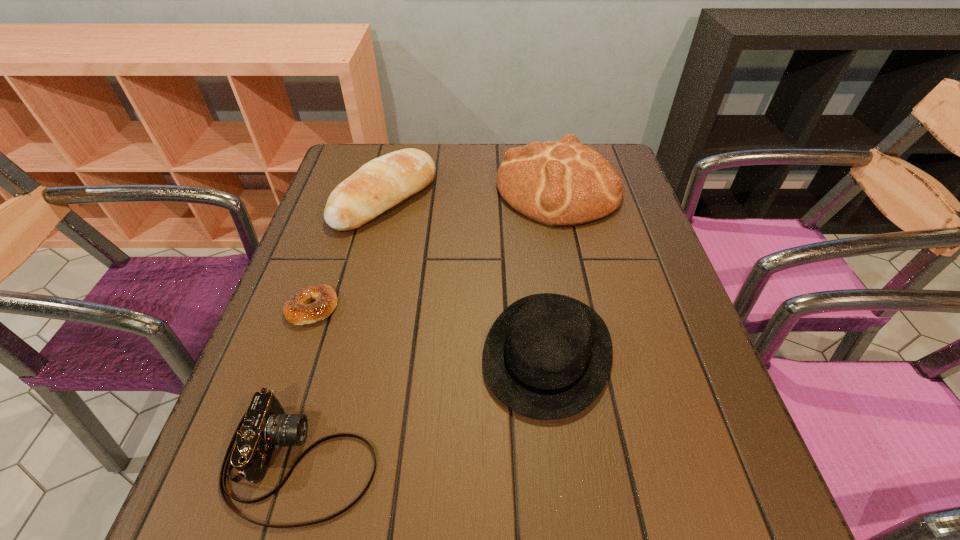
This screenshot has width=960, height=540. In order to click on free space at the far edge of the desktop in this screenshot , I will do `click(463, 163)`.

Find the location of a particular element. vacant area at the near edge is located at coordinates (408, 505).

Identify the location of vacant area at the right edge of the desktop. The image size is (960, 540). (678, 462).

Where is `vacant space at the far left corner`? This screenshot has width=960, height=540. vacant space at the far left corner is located at coordinates (351, 170).

Image resolution: width=960 pixels, height=540 pixels. In the image, there is a desktop. Find the location of `vacant space at the near left corner`. vacant space at the near left corner is located at coordinates [x=186, y=528].

I want to click on blank region between the fourth tallest object and the bagel, so click(307, 383).

Locate an element on the screen. unoccupied area between the bagel and the fourth tallest object is located at coordinates (307, 383).

This screenshot has height=540, width=960. Identify the location of blank region between the fedora and the right bread. (553, 271).

Where is `free space between the right bread and the fedora`? free space between the right bread and the fedora is located at coordinates (553, 271).

Identify the location of vacant region between the second shortest object and the bagel. The height and width of the screenshot is (540, 960). (307, 383).